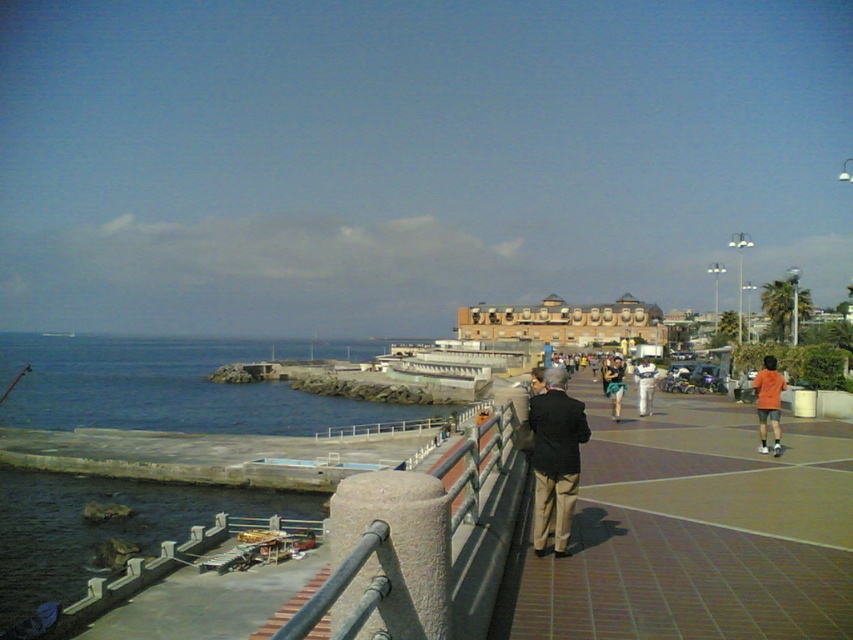
Question: Is dark brown suit at center positioned at the back of orange t-shirt at center?

Choices:
 (A) no
 (B) yes

Answer: (A)

Question: Does brown brick sidewalk at center have a larger size compared to orange fabric shorts at lower right?

Choices:
 (A) yes
 (B) no

Answer: (B)

Question: Which point is farther from the camera taking this photo?

Choices:
 (A) (575, 467)
 (B) (772, 397)

Answer: (B)

Question: Among these points, which one is nearest to the camera?

Choices:
 (A) (640, 454)
 (B) (556, 428)

Answer: (B)

Question: Among these points, which one is farthest from the camera?

Choices:
 (A) (548, 454)
 (B) (109, 371)
 (C) (643, 401)
 (D) (793, 536)

Answer: (B)

Question: Does brown brick sidewalk at center appear under orange t-shirt at center?

Choices:
 (A) no
 (B) yes

Answer: (B)